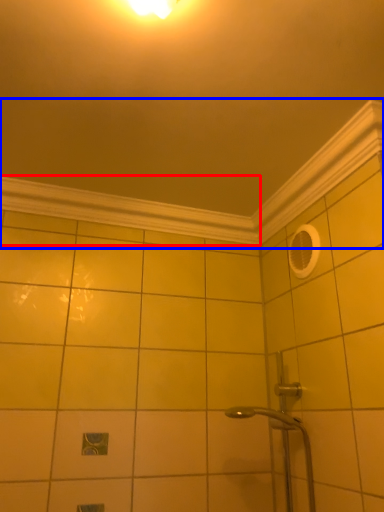
Question: Among these objects, which one is nearest to the camera, molding (highlighted by a red box) or molding (highlighted by a blue box)?

Choices:
 (A) molding
 (B) molding

Answer: (B)